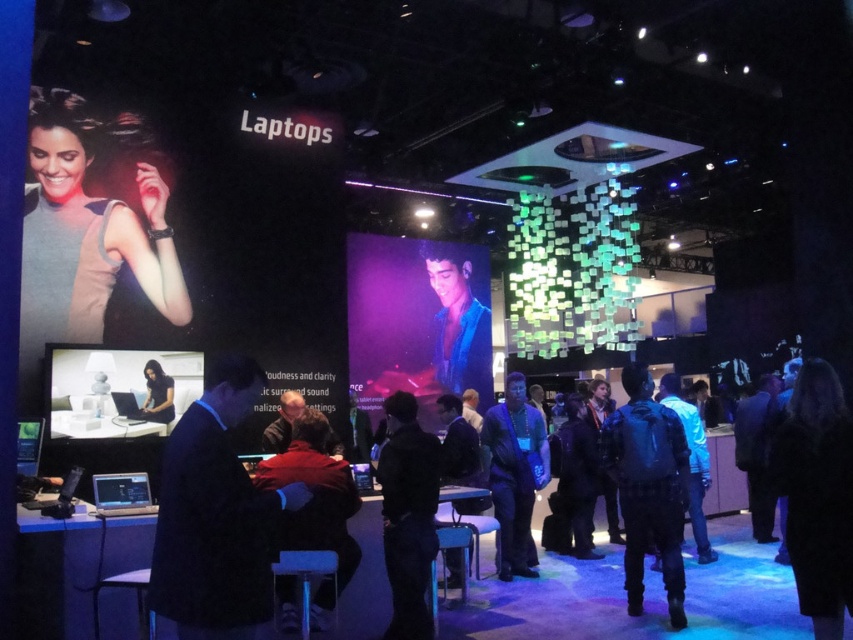
Is dark blue suit at center further to the viewer compared to dark blue backpack at center?

No, dark blue suit at center is in front of dark blue backpack at center.

Between dark blue suit at center and dark blue backpack at center, which one appears on the left side from the viewer's perspective?

dark blue suit at center is more to the left.

At what (x,y) coordinates should I click in order to perform the action: click on dark blue suit at center. Please return your answer as a coordinate pair (x, y). Image resolution: width=853 pixels, height=640 pixels. Looking at the image, I should click on (216, 515).

Identify the location of black matte jacket at center. (408, 515).

Who is more forward, (395, 428) or (450, 250)?

Point (395, 428)

Between point (412, 449) and point (444, 275), which one is positioned behind?

The point (444, 275) is behind.

Image resolution: width=853 pixels, height=640 pixels. I want to click on black matte jacket at center, so click(408, 515).

Between gray matte tank top at upper left and dark blue jeans at center, which one is positioned higher?

Positioned higher is gray matte tank top at upper left.

Is gray matte tank top at upper left in front of dark blue jeans at center?

No, gray matte tank top at upper left is further to the viewer.

Which is behind, point (33, 336) or point (506, 456)?

The point (506, 456) is behind.

This screenshot has height=640, width=853. I want to click on gray matte tank top at upper left, so pyautogui.click(x=88, y=241).